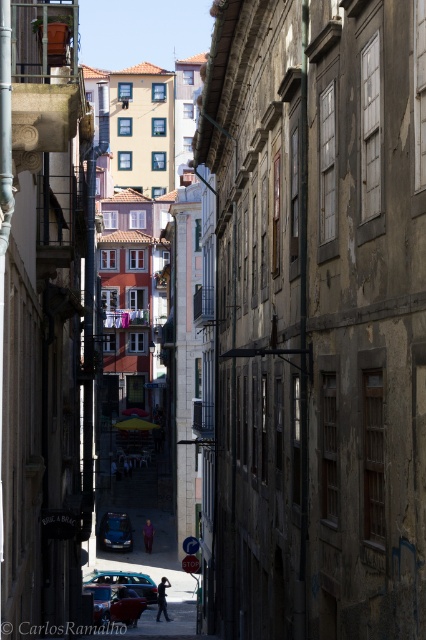
Question: Among these points, which one is farthest from the camera?

Choices:
 (A) (164, 515)
 (B) (118, 522)

Answer: (A)

Question: Is metallic silver car at center closer to camera compared to metallic blue car at center?

Choices:
 (A) yes
 (B) no

Answer: (A)

Question: Which object is farther from the camera taking this photo?

Choices:
 (A) metallic car at center
 (B) metallic blue car at center
 (C) metallic silver car at center

Answer: (B)

Question: Does metallic silver car at center have a larger size compared to metallic blue car at center?

Choices:
 (A) no
 (B) yes

Answer: (B)

Question: Which point appears farthest from the camera in this image?

Choices:
 (A) (143, 605)
 (B) (127, 520)

Answer: (B)

Question: Does metallic car at center appear on the right side of metallic blue car at center?

Choices:
 (A) yes
 (B) no

Answer: (A)